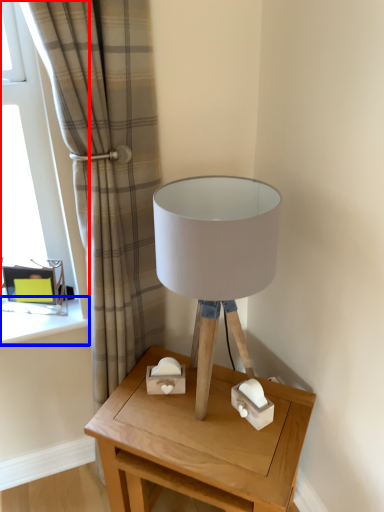
Question: Among these objects, which one is nearest to the camera, window (highlighted by a red box) or window sill (highlighted by a blue box)?

Choices:
 (A) window
 (B) window sill

Answer: (A)